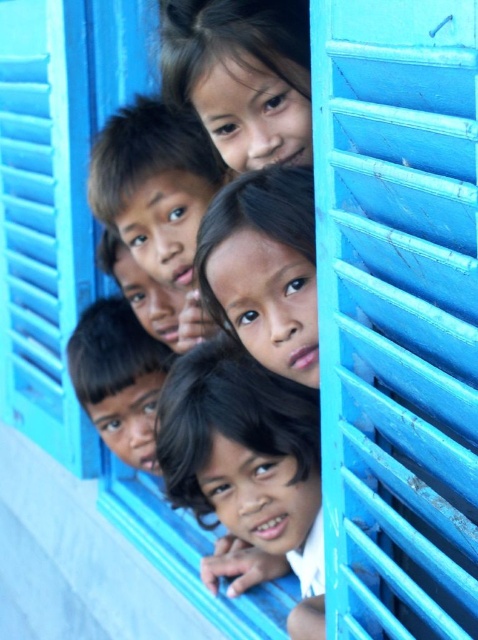
Question: Can you confirm if dark brown hair at center is wider than matte black hair at upper center?

Choices:
 (A) yes
 (B) no

Answer: (A)

Question: Which object appears farthest from the camera in this image?

Choices:
 (A) dark brown hair at center
 (B) matte black hair at upper center

Answer: (A)

Question: Where is matte blue shutter at center right located in relation to dark brown hair at center in the image?

Choices:
 (A) left
 (B) right

Answer: (B)

Question: Is matte blue shutter at center right positioned in front of dark brown hair at center?

Choices:
 (A) yes
 (B) no

Answer: (A)

Question: Which object appears farthest from the camera in this image?

Choices:
 (A) matte black hair at upper center
 (B) matte blue shutter at center right
 (C) dark brown hair at center

Answer: (C)

Question: Which of the following is the closest to the observer?

Choices:
 (A) dark brown hair at center
 (B) matte blue shutter at center right
 (C) matte black hair at upper center

Answer: (B)